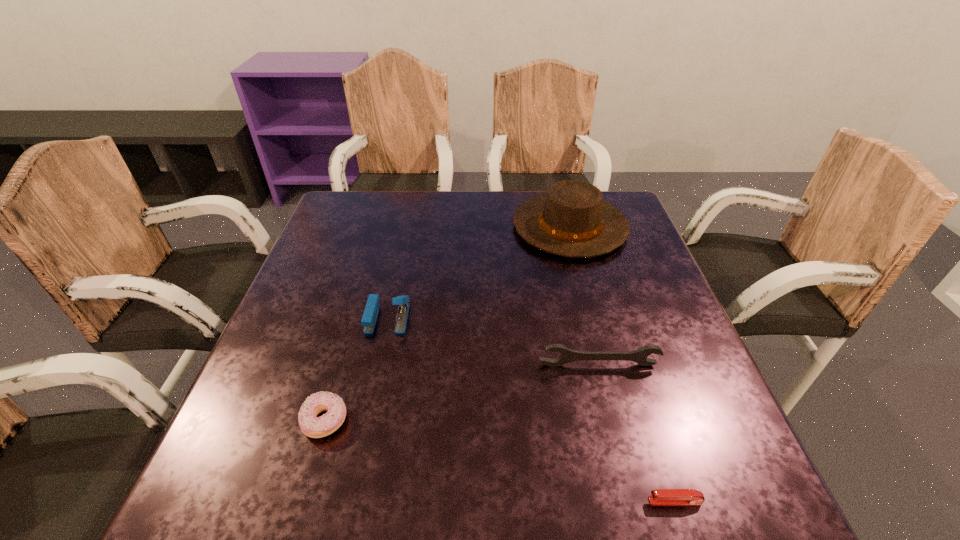
This screenshot has width=960, height=540. Identify the location of vacant area between the doughnut and the third shortest object. (462, 393).

In order to click on the second closest object to the farthest object in this screenshot , I will do (567, 355).

Where is `object that stands as the closest to the third nearest object`? object that stands as the closest to the third nearest object is located at coordinates (659, 496).

Find the location of a particular element. The image size is (960, 540). free region that satisfies the following two spatial constraints: 1. on the back side of the cowboy hat; 2. on the left side of the second nearest object is located at coordinates (382, 227).